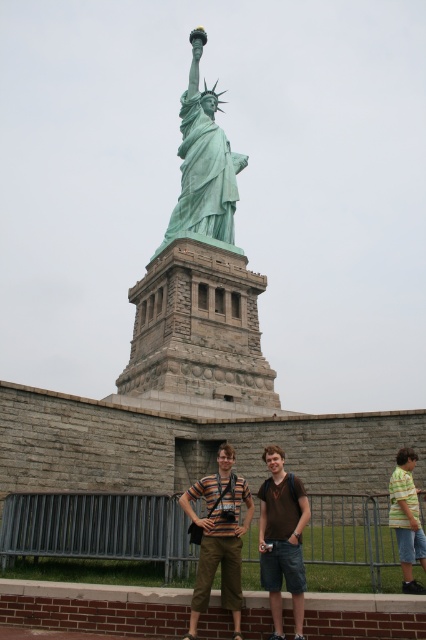
You are a tourist visiting the Statue of Liberty. You notice a person wearing a striped cotton shirt at center and the green patina statue at center. From your perspective, which object is positioned more to the left?

The green patina statue at center is positioned more to the left than the striped cotton shirt at center.